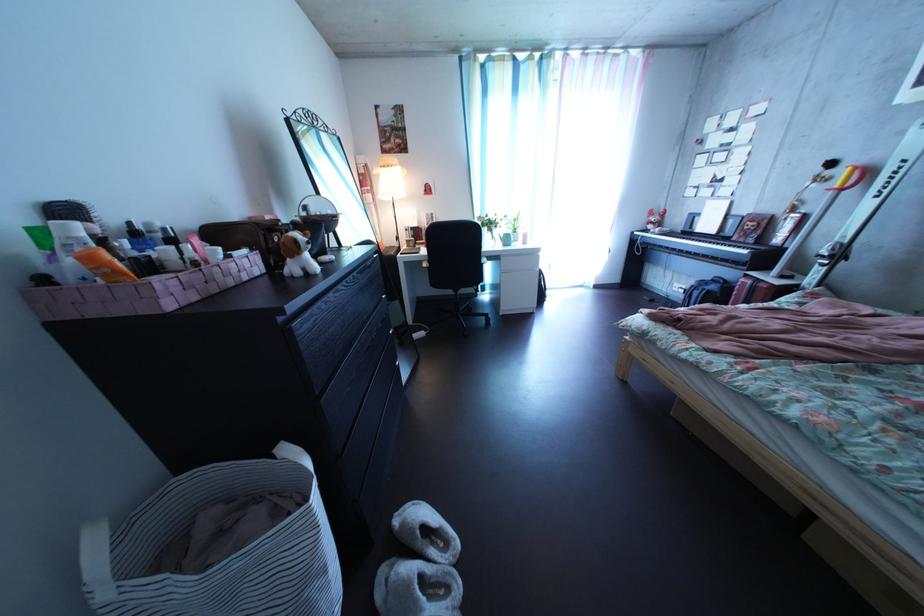
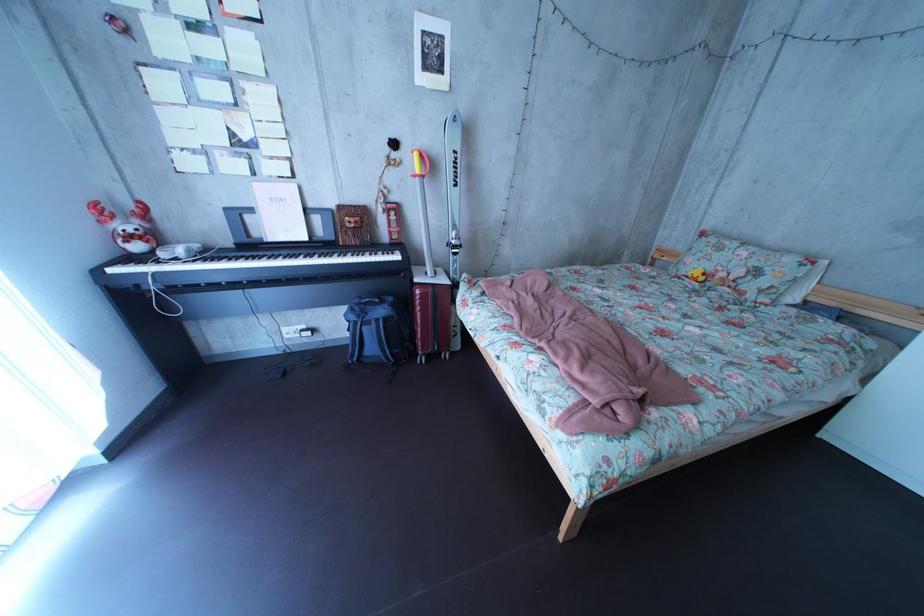
Find the pixel in the second image that matches pixel 683 243 in the first image.

(225, 262)